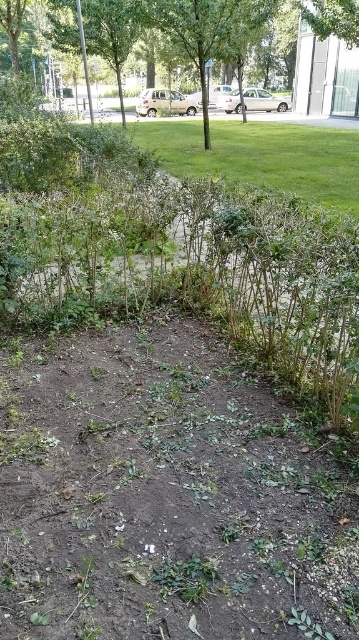
Question: Which of the following is the closest to the observer?

Choices:
 (A) green leafy tree at upper center
 (B) green leafy tree at center

Answer: (A)

Question: Does green leafy tree at upper center have a larger size compared to green leafy tree at center?

Choices:
 (A) no
 (B) yes

Answer: (B)

Question: Does green leafy tree at upper center have a greater width compared to green leafy tree at center?

Choices:
 (A) yes
 (B) no

Answer: (A)

Question: Does green leafy tree at upper center appear over green leafy tree at center?

Choices:
 (A) no
 (B) yes

Answer: (A)

Question: Among these points, which one is farthest from the camera?

Choices:
 (A) (272, 6)
 (B) (238, 35)

Answer: (A)

Question: Which object appears farthest from the camera in this image?

Choices:
 (A) green leafy tree at upper center
 (B) green leafy tree at center

Answer: (B)